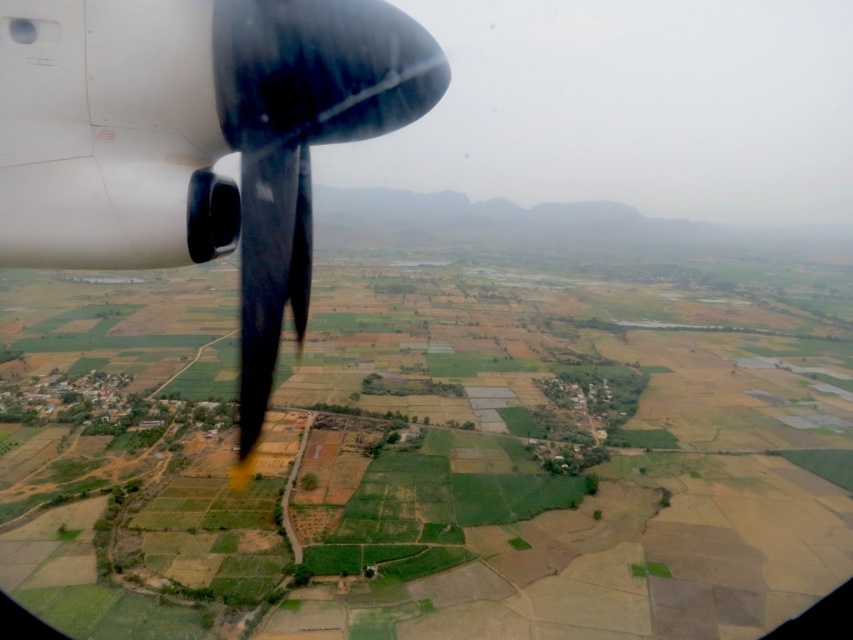
Question: Can you confirm if green grassy farmland at center is positioned to the right of polished metallic propeller at upper left?

Choices:
 (A) no
 (B) yes

Answer: (B)

Question: Which point is farther to the camera?

Choices:
 (A) green grassy farmland at center
 (B) polished metallic propeller at upper left

Answer: (A)

Question: Can you confirm if green grassy farmland at center is positioned to the right of polished metallic propeller at upper left?

Choices:
 (A) no
 (B) yes

Answer: (B)

Question: Does green grassy farmland at center appear over polished metallic propeller at upper left?

Choices:
 (A) yes
 (B) no

Answer: (A)

Question: Which point appears closest to the camera in this image?

Choices:
 (A) [91, 118]
 (B) [618, 368]

Answer: (A)